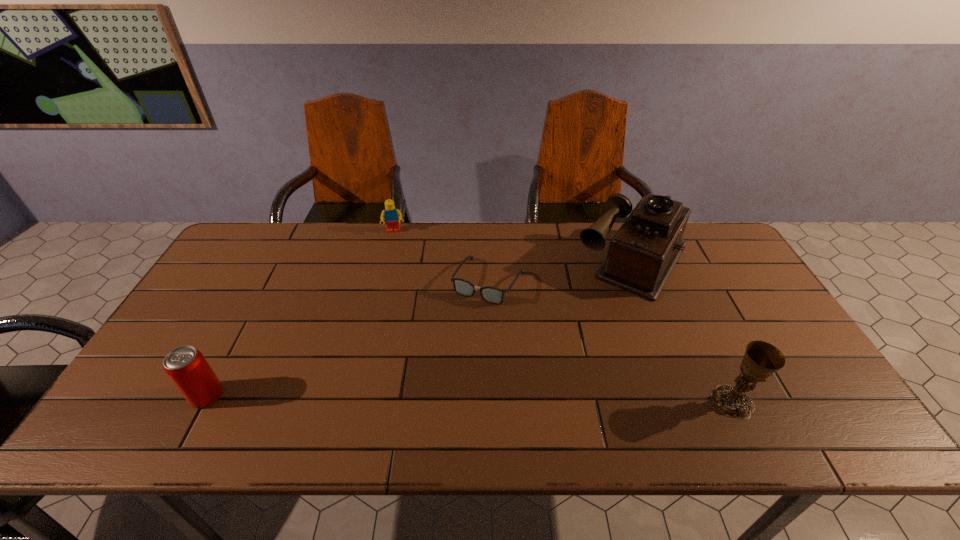
This screenshot has width=960, height=540. Find the location of `phonograph_record situated at the far edge`. phonograph_record situated at the far edge is located at coordinates tap(642, 254).

Locate an element on the screen. The image size is (960, 540). Lego positioned at the far edge is located at coordinates (392, 216).

The image size is (960, 540). I want to click on can located in the near edge section of the desktop, so click(187, 368).

I want to click on chalice that is at the near edge, so click(761, 359).

Locate an element on the screen. This screenshot has height=540, width=960. object at the left edge is located at coordinates point(187,368).

You are a GUI agent. You are given a task and a screenshot of the screen. Output one action in this format:
    pyautogui.click(x=<x>, y=<y>)
    Task: Click on the object present at the right edge
    Image resolution: width=960 pixels, height=540 pixels.
    Given the screenshot: What is the action you would take?
    pyautogui.click(x=642, y=254)

The width and height of the screenshot is (960, 540). I want to click on object at the near left corner, so click(x=187, y=368).

Locate an element on the screen. The image size is (960, 540). object that is at the far right corner is located at coordinates (642, 254).

At what (x,y) coordinates should I click in order to perform the action: click on vacant region at the far edge of the desktop. Please return your answer as a coordinate pair (x, y). The height and width of the screenshot is (540, 960). Looking at the image, I should click on (460, 228).

Where is `vacant region at the near edge of the desktop`? vacant region at the near edge of the desktop is located at coordinates point(693,378).